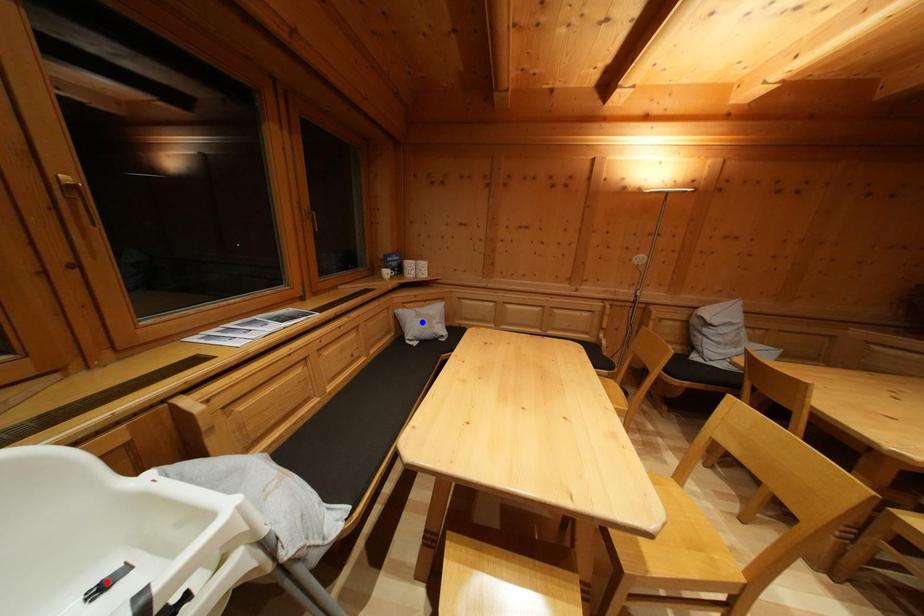
Question: In the image, two points are highlighted. Which point is nearer to the camera? Reply with the corresponding letter.

Choices:
 (A) blue point
 (B) red point

Answer: (B)